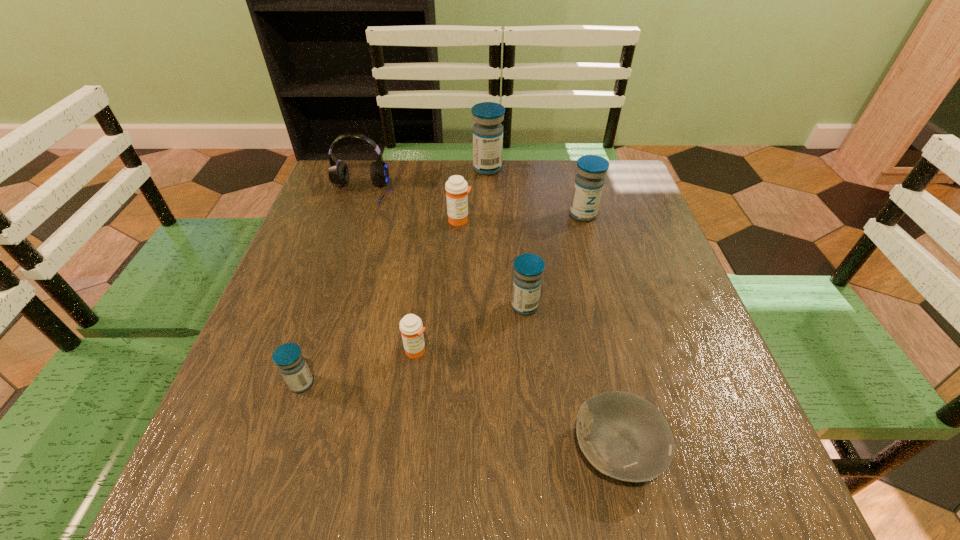
At what (x,y) coordinates should I click in order to perform the action: click on the tallest object. Please return your answer as a coordinate pair (x, y). This screenshot has height=540, width=960. Looking at the image, I should click on (487, 131).

The width and height of the screenshot is (960, 540). Find the location of `the farthest object`. the farthest object is located at coordinates (487, 131).

The height and width of the screenshot is (540, 960). In order to click on headset in this screenshot , I will do `click(338, 172)`.

This screenshot has width=960, height=540. I want to click on the third nearest blue medicine, so point(589,182).

Where is `the rightmost medicine`? This screenshot has width=960, height=540. the rightmost medicine is located at coordinates (589, 182).

This screenshot has height=540, width=960. I want to click on the right orange medicine, so click(457, 189).

Locate an element on the screen. This screenshot has height=540, width=960. the bigger orange medicine is located at coordinates (457, 189).

Image resolution: width=960 pixels, height=540 pixels. Identify the location of the fourth farthest medicine. (528, 268).

I want to click on the second smallest blue medicine, so click(528, 268).

This screenshot has height=540, width=960. I want to click on the third nearest object, so click(x=411, y=327).